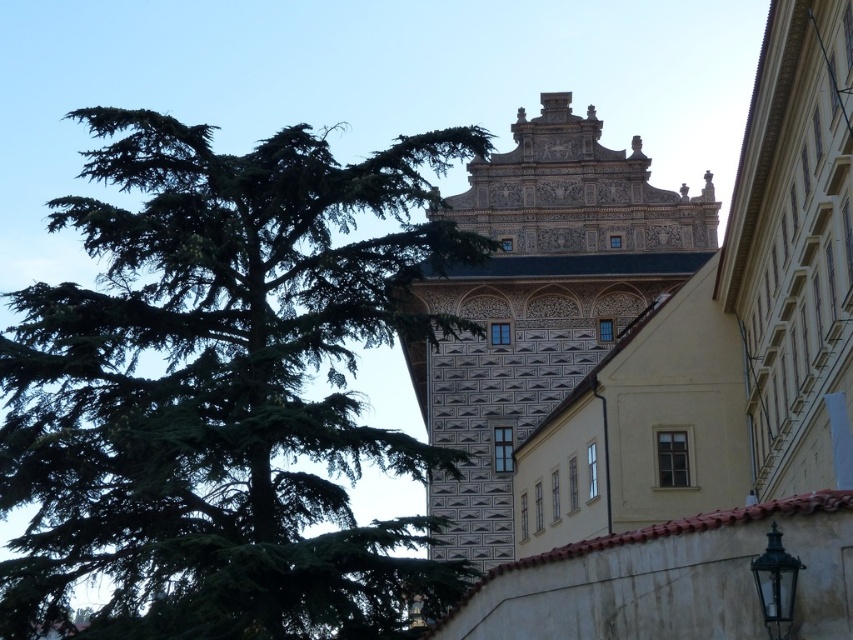
Based on the scene description, what object is located at the coordinates point [222,388]?

The green needlelike tree at left is located at point [222,388].